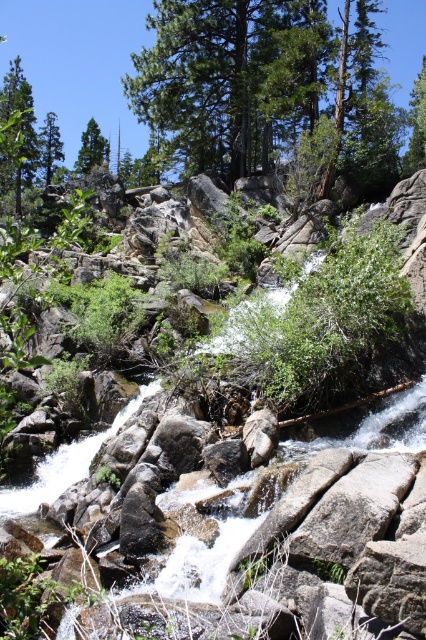
You are a hiker who wants to take a photo of the green leafy tree at left and the green matte tree at upper left. Which tree should you stand closer to in order to capture both trees in the frame without moving the camera?

You should stand closer to the green leafy tree at left because it is shorter than the green matte tree at upper left, allowing both to be in the frame when positioned appropriately.

You are standing at the base of the waterfall and want to take a photo. There are two points of interest in the scene labeled as point (253, 144) and point (58, 148). Which point is closer to your camera lens?

Point (253, 144) is closer to the camera than point (58, 148), so it will appear larger in your photo.